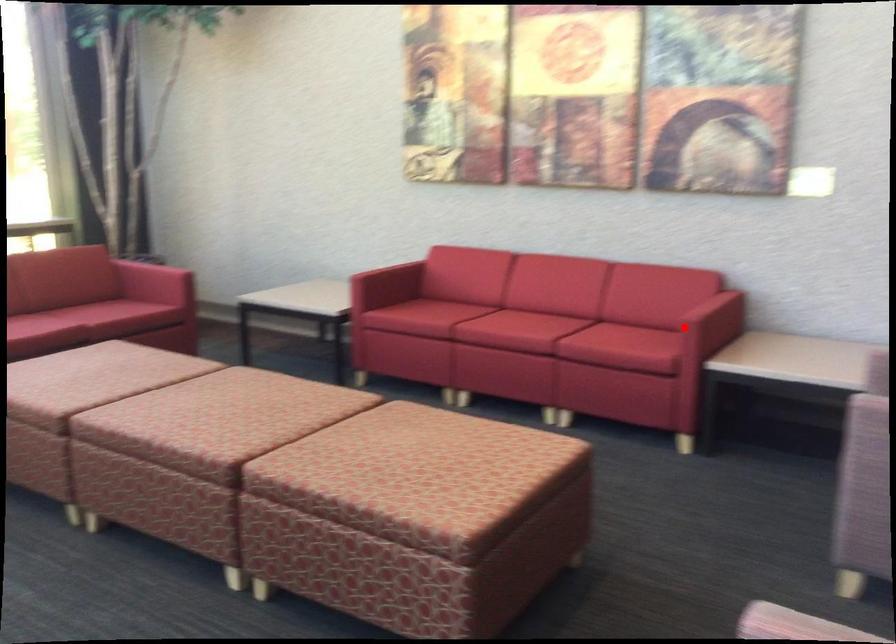
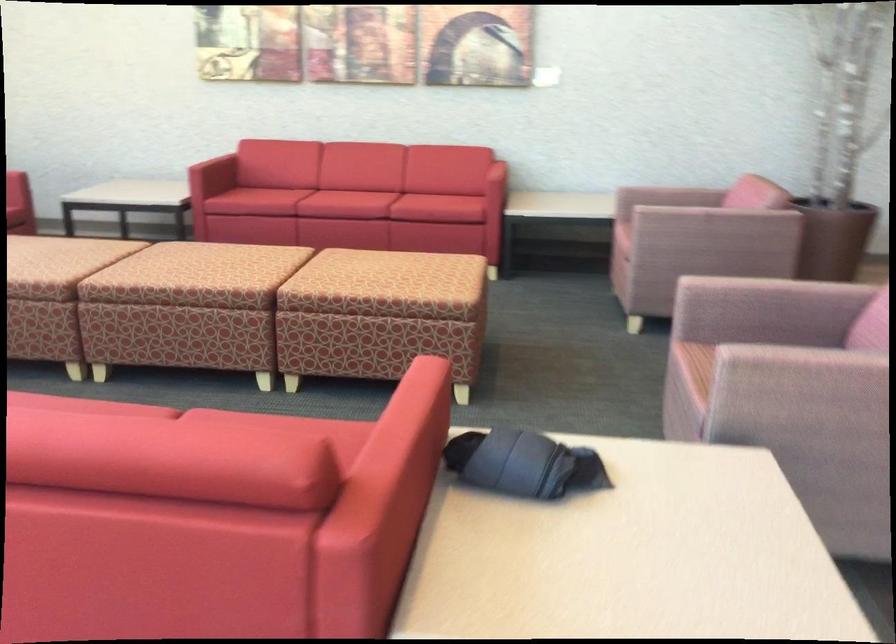
In the second image, find the point that corresponds to the highlighted location in the first image.

(490, 173)